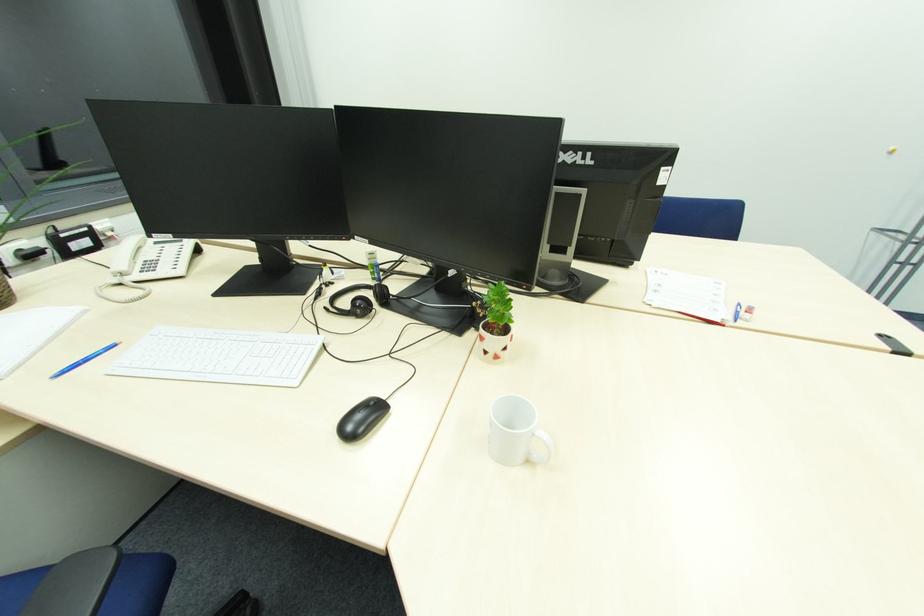
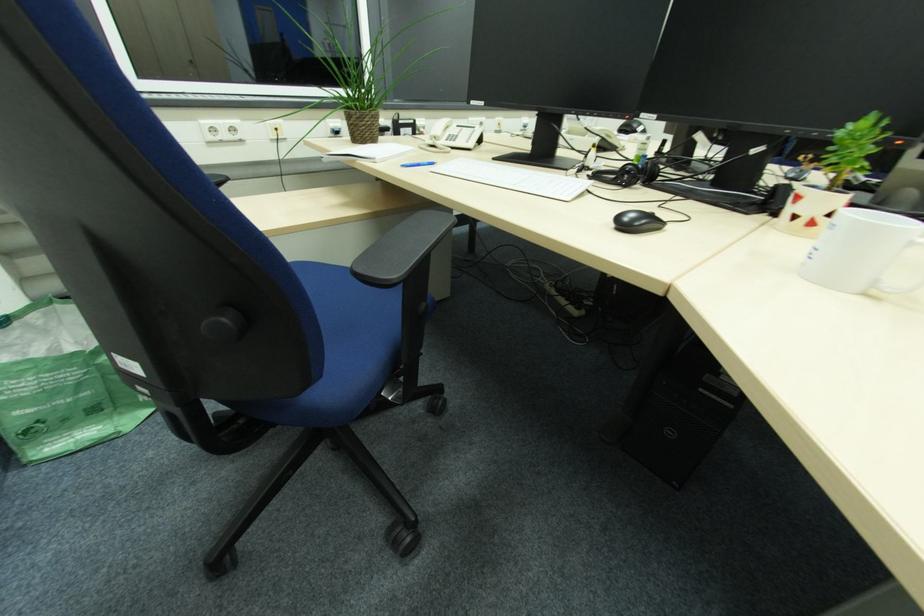
Question: The camera is either moving clockwise (left) or counter-clockwise (right) around the object. The first image is from the beginning of the video and the second image is from the end. Is the camera moving left or right when shooting the video?

Choices:
 (A) Left
 (B) Right

Answer: (B)